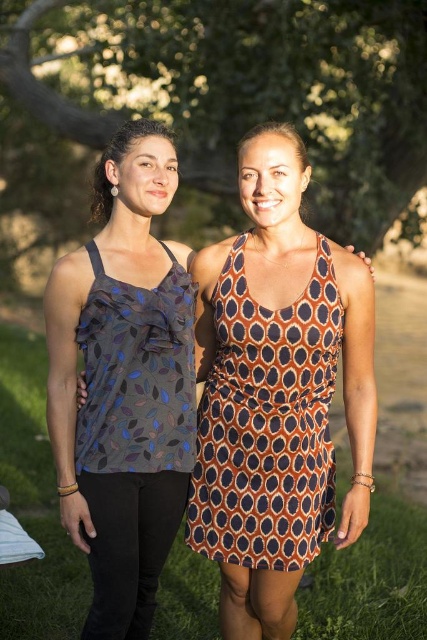
Which is above, orange dotted fabric dress at center or matte gray tank top at upper left?

matte gray tank top at upper left is higher up.

Between orange dotted fabric dress at center and matte gray tank top at upper left, which one has more height?

With more height is orange dotted fabric dress at center.

The width and height of the screenshot is (427, 640). Find the location of `orange dotted fabric dress at center`. orange dotted fabric dress at center is located at coordinates (266, 422).

What do you see at coordinates (123, 384) in the screenshot? I see `matte leaf-patterned tank top at left` at bounding box center [123, 384].

Is matte leaf-patterned tank top at left positioned at the back of green grass at center?

No.

This screenshot has height=640, width=427. In order to click on matte leaf-patterned tank top at left in this screenshot , I will do point(123,384).

At what (x,y) coordinates should I click in order to perform the action: click on matte leaf-patterned tank top at left. Please return your answer as a coordinate pair (x, y). The image size is (427, 640). Looking at the image, I should click on (123, 384).

Does green leafy tree at upper center appear on the right side of green grass at center?

Incorrect, green leafy tree at upper center is not on the right side of green grass at center.

Who is higher up, green leafy tree at upper center or green grass at center?

green leafy tree at upper center is above.

Which is behind, point (383, 180) or point (78, 595)?

The point (383, 180) is more distant.

Locate an element on the screen. The image size is (427, 640). green leafy tree at upper center is located at coordinates (289, 90).